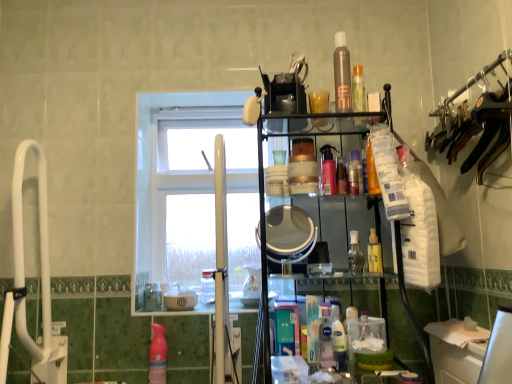
Find the location of a particular element. This screenshot has height=384, width=512. matte silver mirror at center is located at coordinates pos(289,234).

Locate an element on the screen. yellow matte spray bottle at center-right, the first toiletry ordered from the bottom is located at coordinates (374, 253).

The height and width of the screenshot is (384, 512). Describe the element at coordinates (342, 75) in the screenshot. I see `satin brown spray can at upper center, the 1th toiletry viewed from the top` at that location.

Describe the element at coordinates (325, 337) in the screenshot. This screenshot has height=384, width=512. I see `translucent plastic spray bottle at lower center, arranged as the first cleaning product when viewed from the front` at that location.

Identify the location of matte silver mirror at center. Image resolution: width=512 pixels, height=384 pixels. (289, 234).

Are pink glossy spray bottle at lower left, the third cleaning product viewed from the right, and translucent plastic bottle at lower center, the first cleaning product in the right-to-left sequence, making contact?

They are not placed beside each other.

Can you confirm if pink glossy spray bottle at lower left, placed as the first cleaning product when sorted from left to right, is taller than translucent plastic bottle at lower center, the first cleaning product in the right-to-left sequence?

Correct, pink glossy spray bottle at lower left, placed as the first cleaning product when sorted from left to right, is much taller as translucent plastic bottle at lower center, the first cleaning product in the right-to-left sequence.

Between point (155, 377) and point (337, 320), which one is positioned in front?

The point (337, 320) is closer.

How different are the orientations of pink glossy spray bottle at lower left, the third cleaning product viewed from the right, and translucent plastic bottle at lower center, the third cleaning product in the left-to-right sequence, in degrees?

The angular difference between pink glossy spray bottle at lower left, the third cleaning product viewed from the right, and translucent plastic bottle at lower center, the third cleaning product in the left-to-right sequence, is 2.48 degrees.

Which is closer, [378,247] or [361,177]?

Point [378,247] is positioned closer to the camera compared to point [361,177].

Consider the image. Are yellow matte spray bottle at center-right, marked as the 6th toiletry in a top-to-bottom arrangement, and translucent plastic spray bottle at center, acting as the 3th toiletry starting from the bottom, beside each other?

yellow matte spray bottle at center-right, marked as the 6th toiletry in a top-to-bottom arrangement, is not next to translucent plastic spray bottle at center, acting as the 3th toiletry starting from the bottom, and they're not touching.

From the picture: From a real-world perspective, who is located higher, yellow matte spray bottle at center-right, marked as the 6th toiletry in a top-to-bottom arrangement, or translucent plastic spray bottle at center, the 4th toiletry in the top-to-bottom sequence?

translucent plastic spray bottle at center, the 4th toiletry in the top-to-bottom sequence, from a real-world perspective.

Is the depth of white glass window at center greater than that of pink glossy spray bottle at lower left, the third cleaning product viewed from the right?

Yes, white glass window at center is further from the viewer.

How distant is white glass window at center from pink glossy spray bottle at lower left, the third cleaning product viewed from the right?

white glass window at center is 20.95 inches away from pink glossy spray bottle at lower left, the third cleaning product viewed from the right.

Is white glass window at center situated inside pink glossy spray bottle at lower left, placed as the first cleaning product when sorted from left to right, or outside?

white glass window at center cannot be found inside pink glossy spray bottle at lower left, placed as the first cleaning product when sorted from left to right.

Which object is positioned more to the left, pink glossy spray bottle at lower left, the third cleaning product viewed from the right, or yellow matte spray bottle at center-right, the first toiletry ordered from the bottom?

Positioned to the left is pink glossy spray bottle at lower left, the third cleaning product viewed from the right.

Is the surface of pink glossy spray bottle at lower left, placed as the first cleaning product when sorted from left to right, in direct contact with yellow matte spray bottle at center-right, marked as the 6th toiletry in a top-to-bottom arrangement?

No.

From the image's perspective, is pink glossy spray bottle at lower left, the 1th cleaning product in the back-to-front sequence, below yellow matte spray bottle at center-right, the first toiletry ordered from the bottom?

Indeed, from the image's perspective, pink glossy spray bottle at lower left, the 1th cleaning product in the back-to-front sequence, is shown beneath yellow matte spray bottle at center-right, the first toiletry ordered from the bottom.

Which object is wider, pink glossy spray bottle at lower left, which is the 3th cleaning product in front-to-back order, or yellow matte spray bottle at center-right, marked as the 6th toiletry in a top-to-bottom arrangement?

With larger width is pink glossy spray bottle at lower left, which is the 3th cleaning product in front-to-back order.

Considering the relative sizes of white glass window at center and clear plastic bottle at center in the image provided, is white glass window at center thinner than clear plastic bottle at center?

No.

Is white glass window at center far away from clear plastic bottle at center?

No, white glass window at center is in close proximity to clear plastic bottle at center.

From the picture: Measure the distance from white glass window at center to clear plastic bottle at center.

white glass window at center is 17.26 inches from clear plastic bottle at center.

Which is behind, point (200, 95) or point (204, 291)?

The point (200, 95) is farther.

Looking at this image, is the surface of clear plastic bottle at center in direct contact with translucent plastic bottle at lower center, the second cleaning product when ordered from back to front?

No.

From a real-world perspective, between clear plastic bottle at center and translucent plastic bottle at lower center, the third cleaning product in the left-to-right sequence, who is vertically higher?

From a 3D spatial view, clear plastic bottle at center is above.

Find the location of a particular element. The width and height of the screenshot is (512, 384). bottle behind the translucent plastic bottle at lower center, the second cleaning product when ordered from back to front is located at coordinates (208, 286).

Between clear glass bottle at center, marked as the fifth toiletry in a top-to-bottom arrangement, and translucent plastic bottle at lower center, positioned as the 2th cleaning product in front-to-back order, which one has smaller size?

clear glass bottle at center, marked as the fifth toiletry in a top-to-bottom arrangement, is smaller.

Considering the points (350, 270) and (346, 349), which point is in front, point (350, 270) or point (346, 349)?

The point (346, 349) is closer to the camera.

From a real-world perspective, is clear glass bottle at center, marked as the fifth toiletry in a top-to-bottom arrangement, below translucent plastic bottle at lower center, the first cleaning product in the right-to-left sequence?

No, from a real-world perspective, clear glass bottle at center, marked as the fifth toiletry in a top-to-bottom arrangement, is not beneath translucent plastic bottle at lower center, the first cleaning product in the right-to-left sequence.

Can you tell me how much clear glass bottle at center, marked as the fifth toiletry in a top-to-bottom arrangement, and translucent plastic bottle at lower center, positioned as the 2th cleaning product in front-to-back order, differ in facing direction?

There is a 5.53-degree angle between the facing directions of clear glass bottle at center, marked as the fifth toiletry in a top-to-bottom arrangement, and translucent plastic bottle at lower center, positioned as the 2th cleaning product in front-to-back order.

From a real-world perspective, starting from the pink glossy spray bottle at lower left, which is the 3th cleaning product in front-to-back order, which cleaning product is the 1st one vertically above it? Please provide its 2D coordinates.

[(338, 339)]

From a real-world perspective, count 2nd toiletrys downward from the translucent plastic spray bottle at center, the 4th toiletry in the top-to-bottom sequence, and point to it. Please provide its 2D coordinates.

[(374, 253)]

Estimate the real-world distances between objects in this image. Which object is closer to clear plastic bottle at center, yellow matte spray bottle at center-right, the first toiletry ordered from the bottom, or pink glossy spray bottle at center, acting as the 5th toiletry starting from the bottom?

yellow matte spray bottle at center-right, the first toiletry ordered from the bottom, is closer to clear plastic bottle at center.

Which object lies nearer to the anchor point satin brown spray can at upper center, positioned as the 6th toiletry in bottom-to-top order, clear plastic bottle at center or yellow matte spray bottle at center-right, marked as the 6th toiletry in a top-to-bottom arrangement?

yellow matte spray bottle at center-right, marked as the 6th toiletry in a top-to-bottom arrangement.

When comparing their distances from yellow matte spray bottle at center-right, marked as the 6th toiletry in a top-to-bottom arrangement, does white glass window at center or pink glossy bottle at center, positioned as the fourth toiletry in bottom-to-top order, seem closer?

pink glossy bottle at center, positioned as the fourth toiletry in bottom-to-top order, is closer to yellow matte spray bottle at center-right, marked as the 6th toiletry in a top-to-bottom arrangement.

Based on their spatial positions, is satin brown spray can at upper center, positioned as the 6th toiletry in bottom-to-top order, or yellow matte spray bottle at center-right, the first toiletry ordered from the bottom, closer to pink glossy spray bottle at lower left, the third cleaning product viewed from the right?

Among the two, yellow matte spray bottle at center-right, the first toiletry ordered from the bottom, is located nearer to pink glossy spray bottle at lower left, the third cleaning product viewed from the right.

Considering their positions, is satin brown spray can at upper center, positioned as the 6th toiletry in bottom-to-top order, positioned further to yellow matte spray bottle at center-right, marked as the 6th toiletry in a top-to-bottom arrangement, than translucent plastic bottle at lower center, the second cleaning product when ordered from back to front?

satin brown spray can at upper center, positioned as the 6th toiletry in bottom-to-top order, is positioned further to the anchor yellow matte spray bottle at center-right, marked as the 6th toiletry in a top-to-bottom arrangement.

Looking at the image, which one is located closer to clear plastic bottle at center, pink glossy spray bottle at lower left, the 1th cleaning product in the back-to-front sequence, or pink glossy spray bottle at center, marked as the second toiletry in a top-to-bottom arrangement?

pink glossy spray bottle at lower left, the 1th cleaning product in the back-to-front sequence, is positioned closer to the anchor clear plastic bottle at center.

Considering their positions, is translucent plastic bottle at lower center, the third cleaning product in the left-to-right sequence, positioned closer to matte silver mirror at center than clear glass bottle at center, marked as the fifth toiletry in a top-to-bottom arrangement?

Based on the image, clear glass bottle at center, marked as the fifth toiletry in a top-to-bottom arrangement, appears to be nearer to matte silver mirror at center.

Considering their positions, is yellow matte spray bottle at center-right, the first toiletry ordered from the bottom, positioned further to pink glossy bottle at center, the third toiletry in the top-to-bottom sequence, than translucent plastic spray bottle at lower center, which is the 2th cleaning product from left to right?

translucent plastic spray bottle at lower center, which is the 2th cleaning product from left to right, lies further to pink glossy bottle at center, the third toiletry in the top-to-bottom sequence, than the other object.

At what (x,y) coordinates should I click in order to perform the action: click on cleaning product between satin brown spray can at upper center, the 1th toiletry viewed from the top, and translucent plastic bottle at lower center, the first cleaning product in the right-to-left sequence, in the vertical direction. Please return your answer as a coordinate pair (x, y). Looking at the image, I should click on (325, 337).

Image resolution: width=512 pixels, height=384 pixels. I want to click on bottle between pink glossy bottle at center, positioned as the fourth toiletry in bottom-to-top order, and translucent plastic bottle at lower center, positioned as the 2th cleaning product in front-to-back order, from top to bottom, so click(208, 286).

Where is `mirror between clear plastic bottle at center and translucent plastic spray bottle at center, the 4th toiletry in the top-to-bottom sequence`? The width and height of the screenshot is (512, 384). mirror between clear plastic bottle at center and translucent plastic spray bottle at center, the 4th toiletry in the top-to-bottom sequence is located at coordinates (289, 234).

Where is `mirror between pink glossy spray bottle at center, marked as the second toiletry in a top-to-bottom arrangement, and translucent plastic spray bottle at lower center, which is the 2th cleaning product from left to right, in the vertical direction`? Image resolution: width=512 pixels, height=384 pixels. mirror between pink glossy spray bottle at center, marked as the second toiletry in a top-to-bottom arrangement, and translucent plastic spray bottle at lower center, which is the 2th cleaning product from left to right, in the vertical direction is located at coordinates (289, 234).